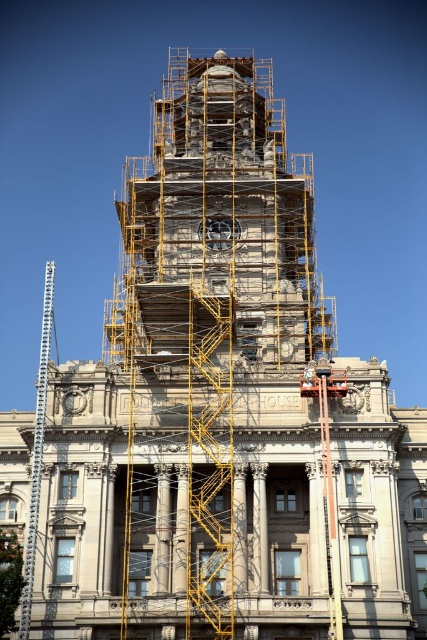
You are standing in front of the historic building and want to know how far the point marked at coordinates [218,570] is from you. Can you determine the distance?

The point marked at coordinates [218,570] is 58.88 meters away from the viewer.

You are an architect inspecting the renovation site of the historic building. You notice the stone scaffolding at center and the yellow metal scaffolding at center. Which scaffolding structure is closer to you from your current viewpoint?

The stone scaffolding at center is closer to you because the yellow metal scaffolding at center is positioned behind it.

You are an inspector checking the safety of the yellow metal scaffolding at center and the white hard hat at center. Which object is taller?

The yellow metal scaffolding at center is taller than the white hard hat at center.